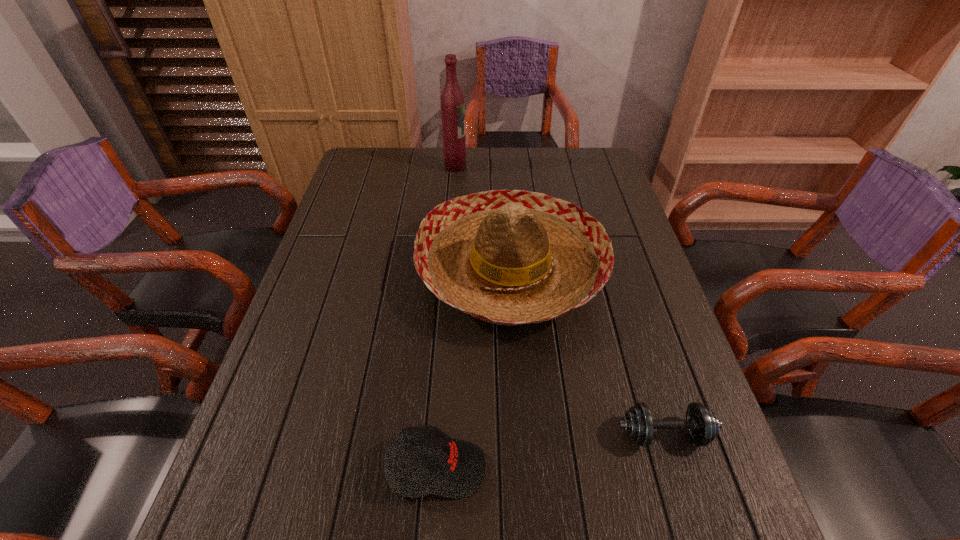
In order to click on object positioned at the far edge in this screenshot , I will do `click(452, 99)`.

This screenshot has width=960, height=540. I want to click on sombrero that is at the right edge, so click(x=510, y=257).

This screenshot has width=960, height=540. I want to click on dumbbell located at the right edge, so click(x=702, y=424).

Where is `vacant area at the far edge of the desktop`? vacant area at the far edge of the desktop is located at coordinates (514, 166).

In the image, there is a desktop. Identify the location of vacant space at the left edge. (326, 357).

At what (x,y) coordinates should I click in order to perform the action: click on free space at the right edge of the desktop. Please return your answer as a coordinate pair (x, y). Looking at the image, I should click on (672, 525).

Find the location of a particular element. This screenshot has width=960, height=540. vacant area that lies between the third shortest object and the baseball cap is located at coordinates click(x=474, y=369).

You are a GUI agent. You are given a task and a screenshot of the screen. Output one action in this format:
    pyautogui.click(x=<x>, y=<y>)
    Task: Click on the free space between the tallest object and the second shortest object
    
    Given the screenshot: What is the action you would take?
    pyautogui.click(x=446, y=318)

Image resolution: width=960 pixels, height=540 pixels. I want to click on vacant space in between the third nearest object and the dumbbell, so click(588, 352).

This screenshot has width=960, height=540. Identify the location of empty space that is in between the baseball cap and the liquor. [446, 318].